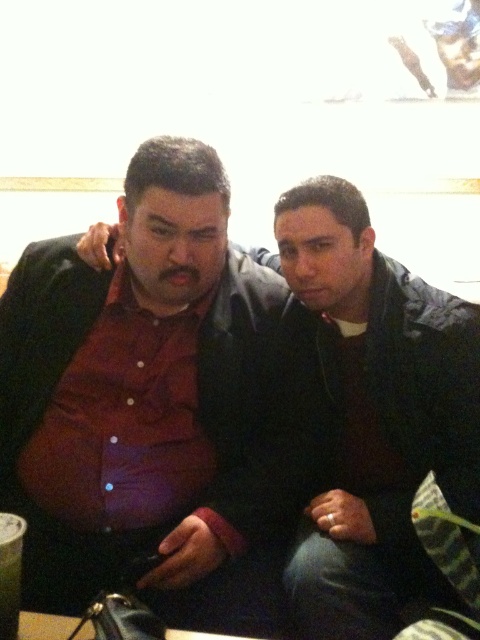
You are a waiter at this dining establishment. You need to place a new drink order for the customer seated near the clear plastic cup at lower left. Where should you place the new drink to avoid spilling it near the matte black jacket at center?

The matte black jacket at center is above the clear plastic cup at lower left, so placing the new drink near the clear plastic cup at lower left would be safe as it is below the jacket and less likely to spill onto it.

You are a delivery person who needs to place a small package between the matte black shirt at center and the clear plastic cup at lower left. Can you fit it there if the package is 18 inches long?

The distance between the matte black shirt at center and the clear plastic cup at lower left is 20.31 inches. Since the package is 18 inches long, it can fit in the space between them as there is enough room.

You are a delivery person who needs to place a small package between the matte black jacket at center and the clear plastic cup at lower left. Considering their sizes, which object should you place the package closer to?

The matte black jacket at center has a larger size compared to the clear plastic cup at lower left, so you should place the package closer to the matte black jacket at center to ensure there is enough space.